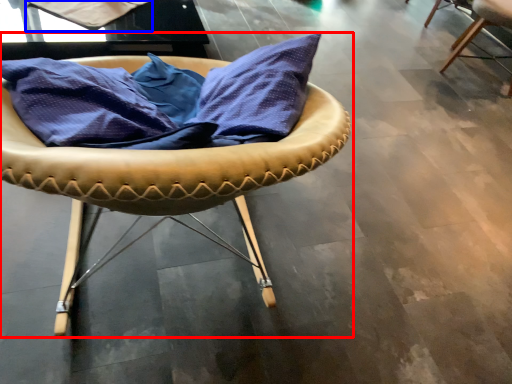
Question: Which object appears closest to the camera in this image, chair (highlighted by a red box) or fabric (highlighted by a blue box)?

Choices:
 (A) chair
 (B) fabric

Answer: (A)